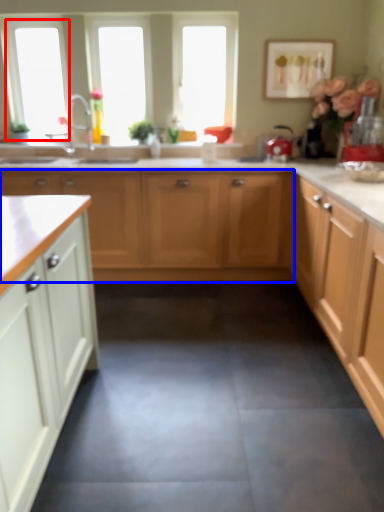
Question: Among these objects, which one is farthest to the camera, window screen (highlighted by a red box) or cabinetry (highlighted by a blue box)?

Choices:
 (A) window screen
 (B) cabinetry

Answer: (A)